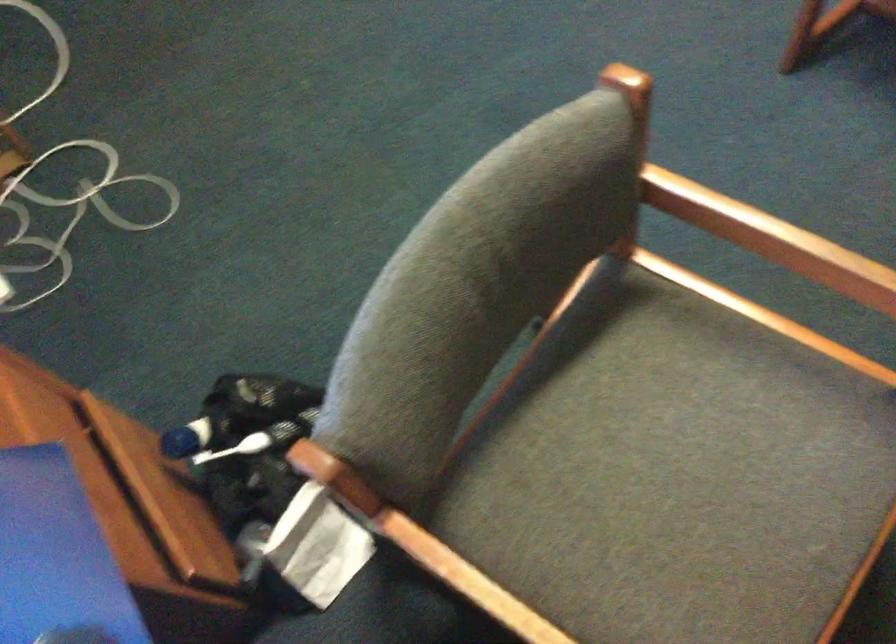
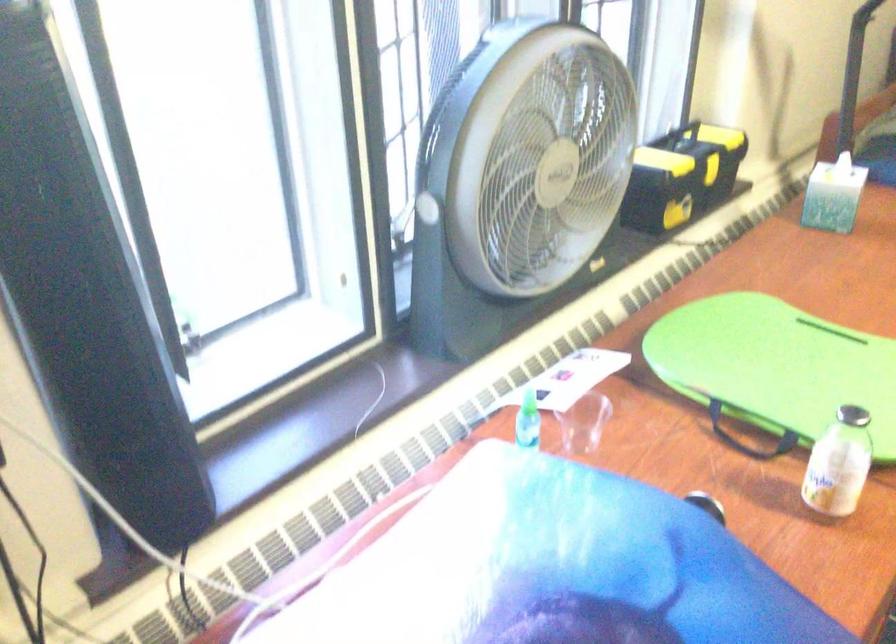
Question: The images are taken continuously from a first-person perspective. In which direction is your viewpoint rotating?

Choices:
 (A) Left
 (B) Right
 (C) Up
 (D) Down

Answer: (A)